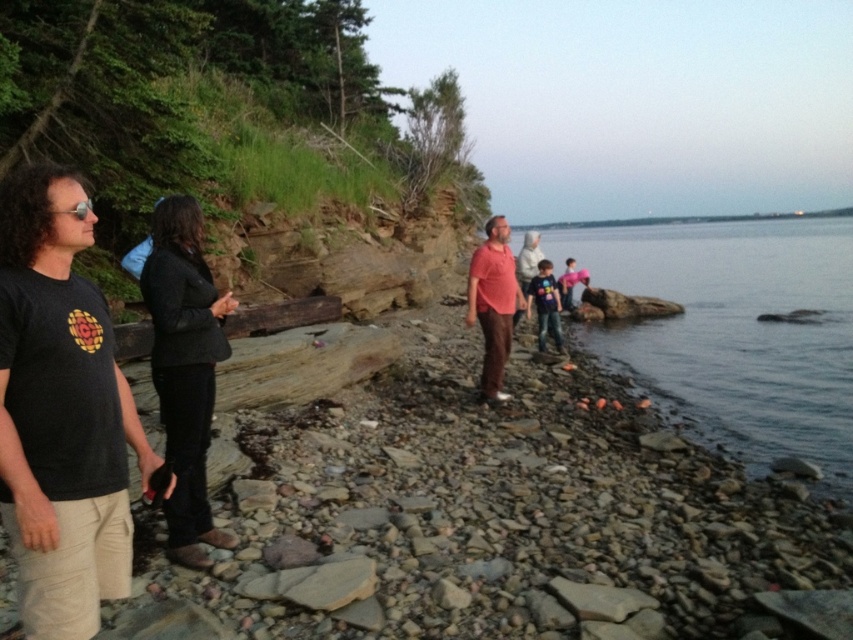
You are standing on the rocky shoreline and see the clear water at lower right and the pink fabric at center. Which object is located to the right of the other?

The clear water at lower right is to the right of the pink fabric at center.

You are standing at the center of the rocky shoreline and want to reach the clear water at lower right. Which direction should you move to get there?

The clear water at lower right is located at point (735, 330), so you should move towards the lower right direction to reach it.

You are standing at the center of the image and want to walk to the clear water at lower right. Which direction should you face to move directly towards it?

You should face towards the lower right direction to move directly towards the clear water at lower right since its 2D location is at point [735,330].